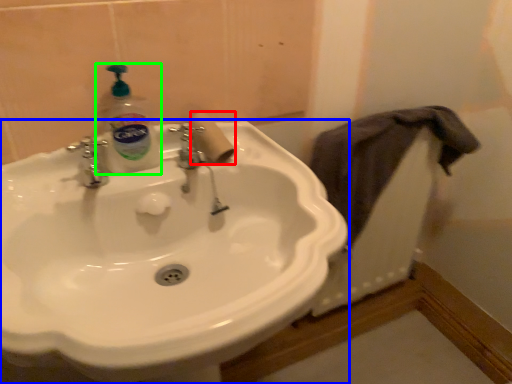
Question: Estimate the real-world distances between objects in this image. Which object is closer to toilet paper (highlighted by a red box), sink (highlighted by a blue box) or cleaning product (highlighted by a green box)?

Choices:
 (A) sink
 (B) cleaning product

Answer: (B)